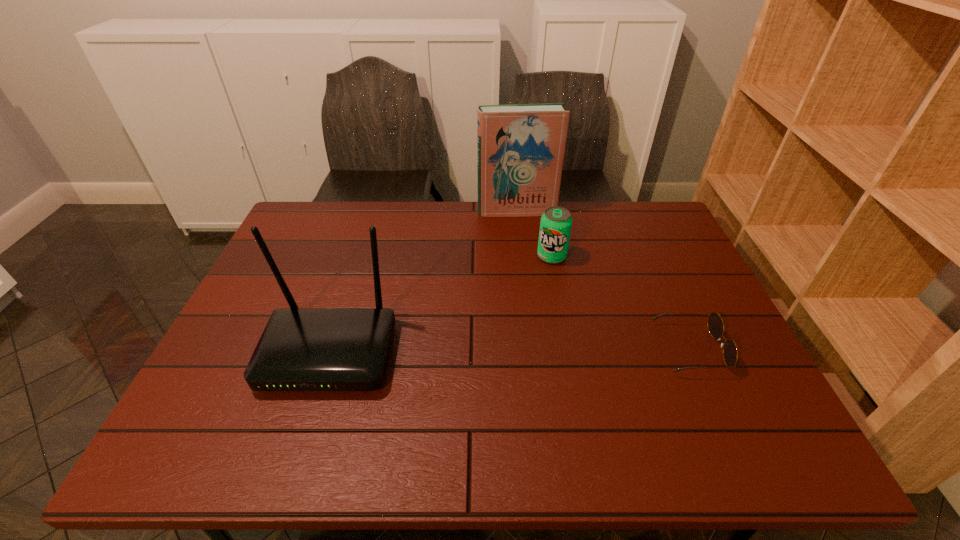
Locate an element on the screen. The height and width of the screenshot is (540, 960). free space that satisfies the following two spatial constraints: 1. on the front side of the sunglasses; 2. on the lenses of the pop soda is located at coordinates (569, 349).